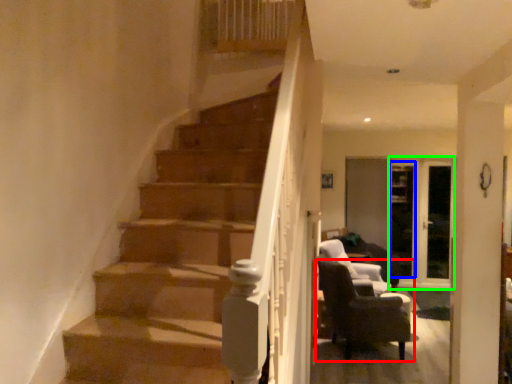
Question: Based on their relative distances, which object is nearer to chair (highlighted by a red box)? Choose from glass door (highlighted by a blue box) and glass door (highlighted by a green box).

Choices:
 (A) glass door
 (B) glass door

Answer: (B)